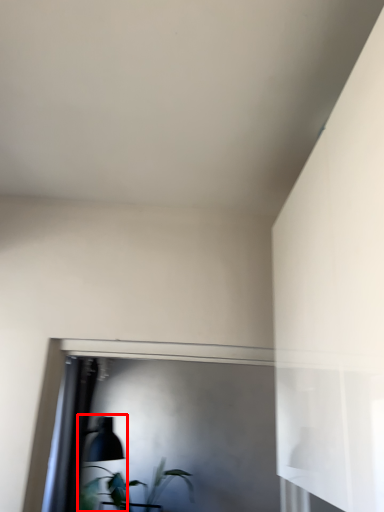
Question: Considering the relative positions of table lamp (annotated by the red box) and houseplant in the image provided, where is table lamp (annotated by the red box) located with respect to the staircase?

Choices:
 (A) left
 (B) right

Answer: (A)